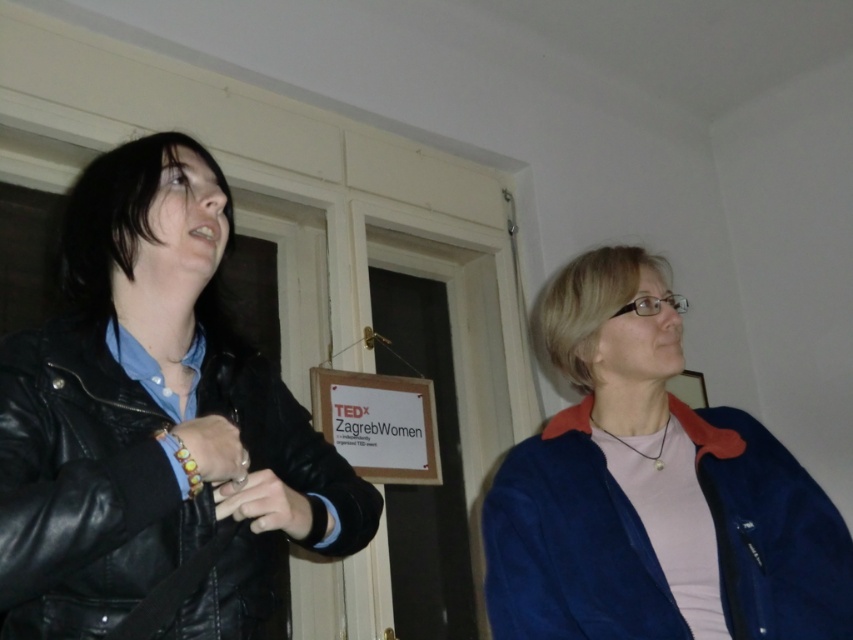
Is black leather jacket at left wider than blue suede jacket at right?

Incorrect, black leather jacket at left's width does not surpass blue suede jacket at right's.

Which is below, black leather jacket at left or blue suede jacket at right?

blue suede jacket at right is lower down.

Is point (137, 552) closer to viewer compared to point (770, 566)?

Yes, point (137, 552) is closer to viewer.

Find the location of a particular element. The height and width of the screenshot is (640, 853). black leather jacket at left is located at coordinates (148, 419).

Is point (651, 294) farther from camera compared to point (264, 477)?

Yes, it is behind point (264, 477).

Can you confirm if blue suede jacket at right is positioned below matte black ring at lower left?

No, blue suede jacket at right is not below matte black ring at lower left.

Between point (567, 308) and point (264, 499), which one is positioned behind?

The point (567, 308) is behind.

Where is `blue suede jacket at right`? The height and width of the screenshot is (640, 853). blue suede jacket at right is located at coordinates (653, 492).

Is matte black ring at lower left taller than leather bracelet at left?

Indeed, matte black ring at lower left has a greater height compared to leather bracelet at left.

Who is more forward, (x=242, y=504) or (x=201, y=476)?

Positioned in front is point (x=201, y=476).

Where is `matte black ring at lower left`? matte black ring at lower left is located at coordinates (264, 504).